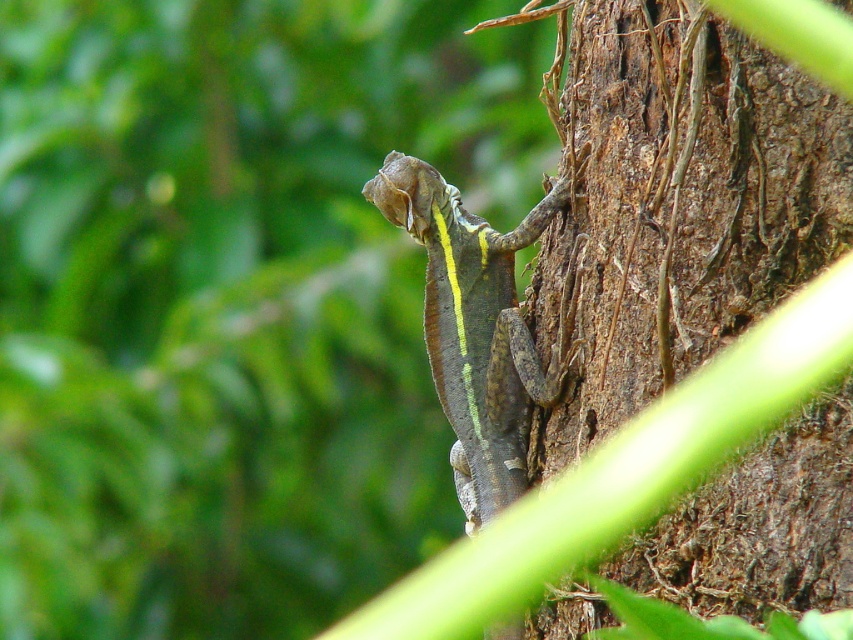
Between brown rough bark at center and shiny green scales at center, which one has more height?

brown rough bark at center is taller.

Locate an element on the screen. The height and width of the screenshot is (640, 853). brown rough bark at center is located at coordinates (677, 209).

Find the location of a particular element. Image resolution: width=853 pixels, height=640 pixels. brown rough bark at center is located at coordinates (677, 209).